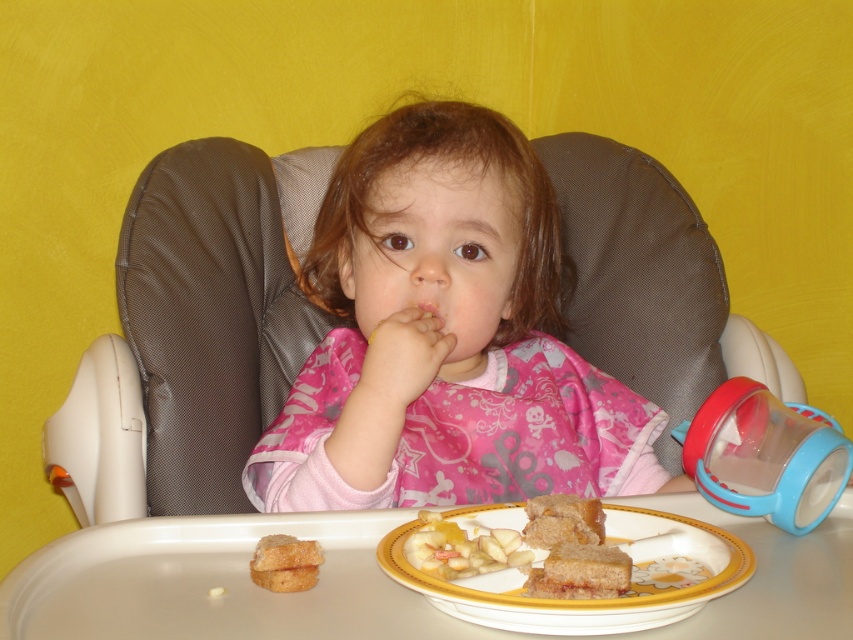
Question: Based on their relative distances, which object is nearer to the pink fabric bib at center?

Choices:
 (A) smooth white bread at plate center
 (B) golden crispy bread at plate center
 (C) yellow ceramic plate with food at lower center

Answer: (C)

Question: Is pink fabric bib at center below yellow ceramic plate with food at lower center?

Choices:
 (A) no
 (B) yes

Answer: (A)

Question: Which object is positioned closest to the smooth white bread at plate center?

Choices:
 (A) pink fabric bib at center
 (B) yellow ceramic plate with food at lower center
 (C) golden crispy bread at plate center

Answer: (B)

Question: Does yellow ceramic plate with food at lower center appear over smooth white bread at plate center?

Choices:
 (A) yes
 (B) no

Answer: (B)

Question: Which object is the closest to the golden crispy bread at plate center?

Choices:
 (A) yellow ceramic plate with food at lower center
 (B) smooth white bread at plate center
 (C) pink fabric bib at center

Answer: (B)

Question: Is smooth white bread at plate center smaller than golden crispy bread at plate center?

Choices:
 (A) yes
 (B) no

Answer: (B)